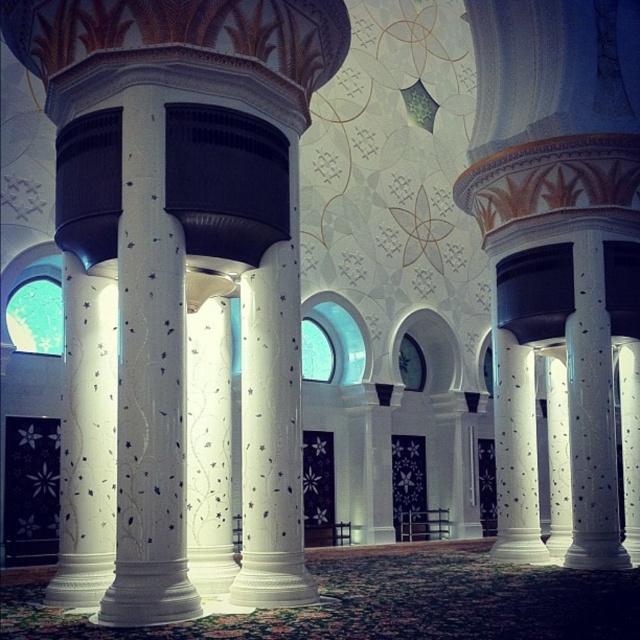
Is point (145, 600) less distant than point (620, 548)?

Yes, point (145, 600) is closer to viewer.

The width and height of the screenshot is (640, 640). Describe the element at coordinates (148, 384) in the screenshot. I see `white glossy column at center` at that location.

Which is in front, point (138, 376) or point (605, 344)?

Point (138, 376) is more forward.

This screenshot has width=640, height=640. In order to click on white glossy column at center in this screenshot , I will do `click(148, 384)`.

Can you confirm if white textured column at center is positioned to the right of white speckled marble column at right?

No, white textured column at center is not to the right of white speckled marble column at right.

How far apart are white textured column at center and white speckled marble column at right?

9.83 meters

Which is behind, point (100, 380) or point (588, 300)?

Point (588, 300)

The width and height of the screenshot is (640, 640). In order to click on white textured column at center in this screenshot , I will do `click(86, 440)`.

Measure the distance between point [145,442] and camera.

Point [145,442] is 9.51 meters from camera.

Between point (154, 140) and point (74, 323), which one is positioned in front?

Point (154, 140) is in front.

What are the coordinates of `white glossy column at center` in the screenshot? It's located at tap(148, 384).